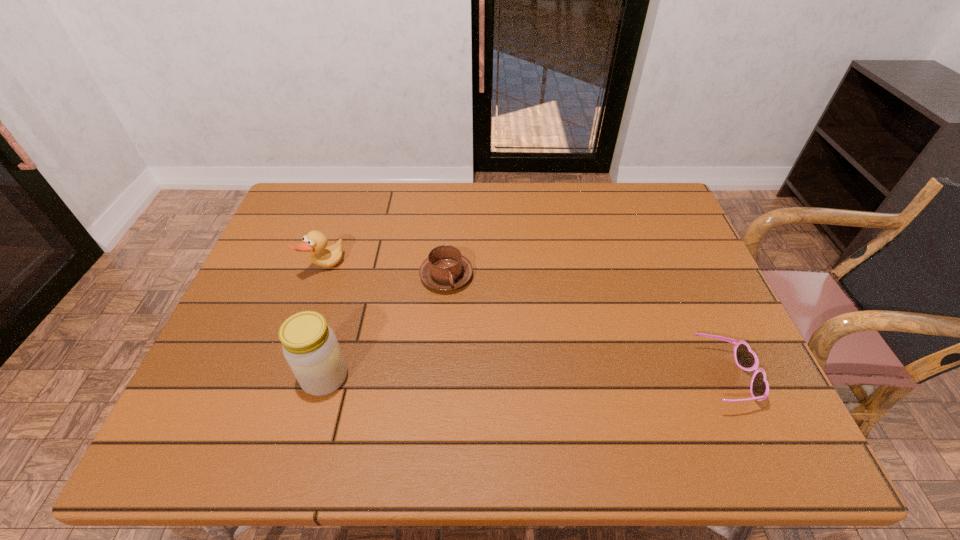
Image resolution: width=960 pixels, height=540 pixels. I want to click on vacant point located 0.180m on the side of the cappuccino with the handle, so point(505,335).

This screenshot has width=960, height=540. Find the location of `blank area located 0.150m on the side of the cappuccino with the handle`. blank area located 0.150m on the side of the cappuccino with the handle is located at coordinates (497, 328).

You are a GUI agent. You are given a task and a screenshot of the screen. Output one action in this format:
    pyautogui.click(x=<x>, y=<y>)
    Task: Click on the vacant area situated 0.390m on the side of the cappuccino with the handle
    
    Given the screenshot: What is the action you would take?
    pyautogui.click(x=567, y=399)

Find the location of `jar present at the near edge`. jar present at the near edge is located at coordinates [310, 346].

Locate an element on the screen. The height and width of the screenshot is (540, 960). sunglasses that is positioned at the near edge is located at coordinates (746, 359).

Locate an element on the screen. The width and height of the screenshot is (960, 540). object present at the left edge is located at coordinates (314, 242).

Locate an element on the screen. Image resolution: width=960 pixels, height=540 pixels. object positioned at the right edge is located at coordinates (746, 359).

You are a GUI agent. You are given a task and a screenshot of the screen. Output one action in this format:
    pyautogui.click(x=<x>, y=<y>)
    Task: Click on the object positioned at the near right corner
    The height and width of the screenshot is (540, 960).
    Given the screenshot: What is the action you would take?
    pyautogui.click(x=746, y=359)

I want to click on free space at the far edge, so click(x=384, y=183).

In the image, there is a desktop. Identify the location of vacant region at the near edge. This screenshot has height=540, width=960. (355, 407).